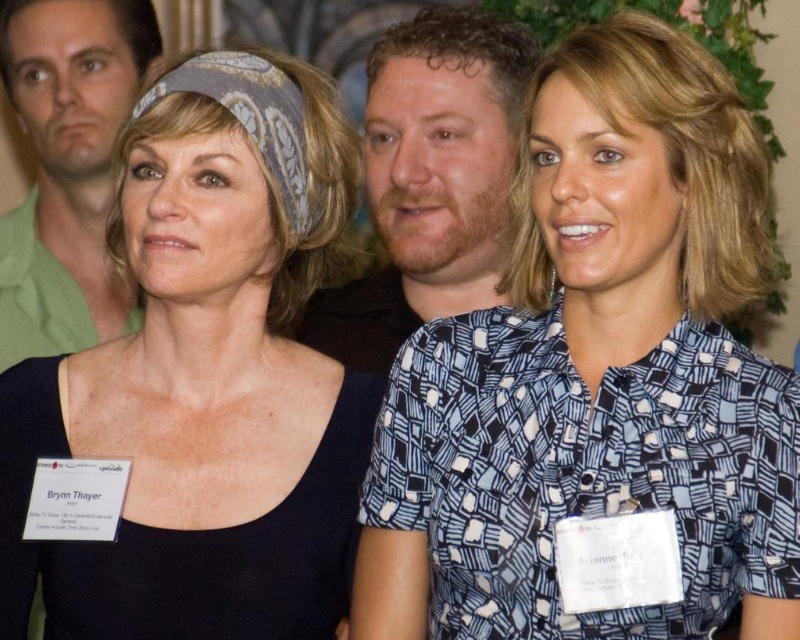
This screenshot has width=800, height=640. What do you see at coordinates (200, 384) in the screenshot? I see `black matte dress at center` at bounding box center [200, 384].

Does black matte dress at center lie in front of bearded man at center?

Yes.

Is point (26, 554) positioned behind point (500, 148)?

No, it is in front of (500, 148).

I want to click on black matte dress at center, so click(x=200, y=384).

Does blue printed blouse at center have a greater width compared to bearded man at center?

Correct, the width of blue printed blouse at center exceeds that of bearded man at center.

Does blue printed blouse at center have a smaller size compared to bearded man at center?

No.

Is point (710, 579) closer to viewer compared to point (408, 195)?

Yes, it is.

Image resolution: width=800 pixels, height=640 pixels. In order to click on blue printed blouse at center in this screenshot , I will do `click(600, 384)`.

Does bearded man at center appear under green matte shirt at upper left?

Correct, bearded man at center is located below green matte shirt at upper left.

Does bearded man at center have a greater width compared to green matte shirt at upper left?

Indeed, bearded man at center has a greater width compared to green matte shirt at upper left.

Measure the distance between point (x=354, y=362) and camera.

They are 2.01 meters apart.

Image resolution: width=800 pixels, height=640 pixels. I want to click on bearded man at center, so click(x=430, y=179).